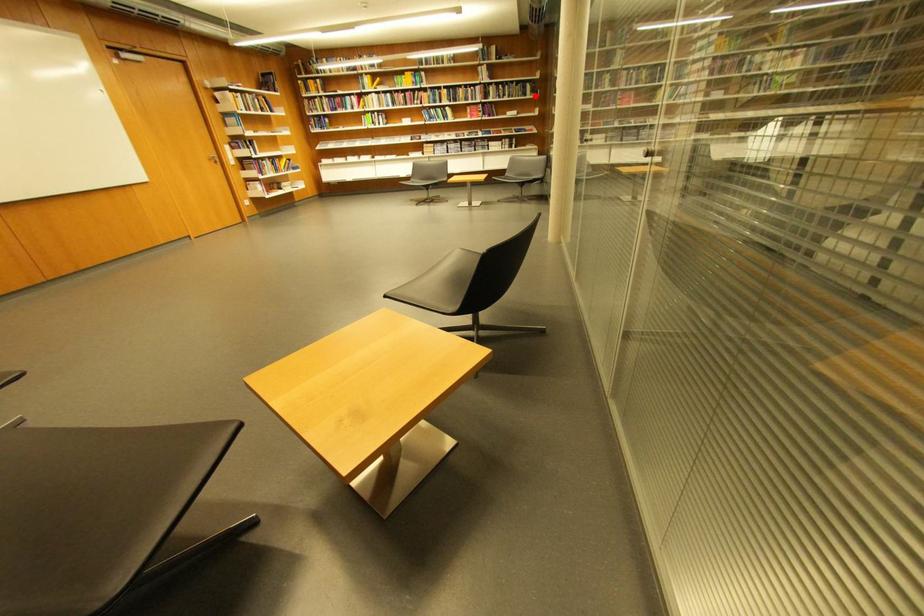
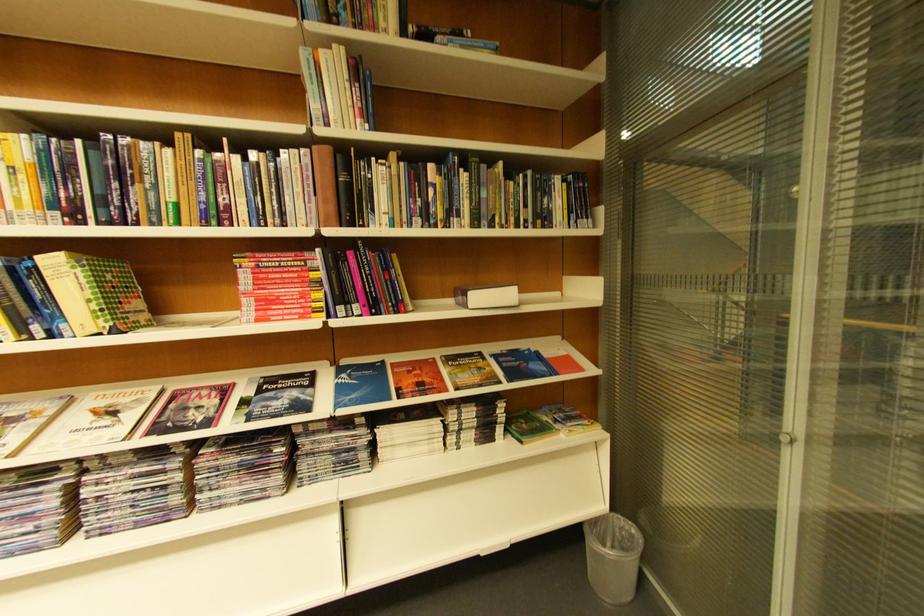
Question: I am providing you with two images of the same scene from different viewpoints. A red point is shown in image1. For the corresponding object point in image2, is it positioned nearer or farther from the camera?

Choices:
 (A) Nearer
 (B) Farther

Answer: (B)